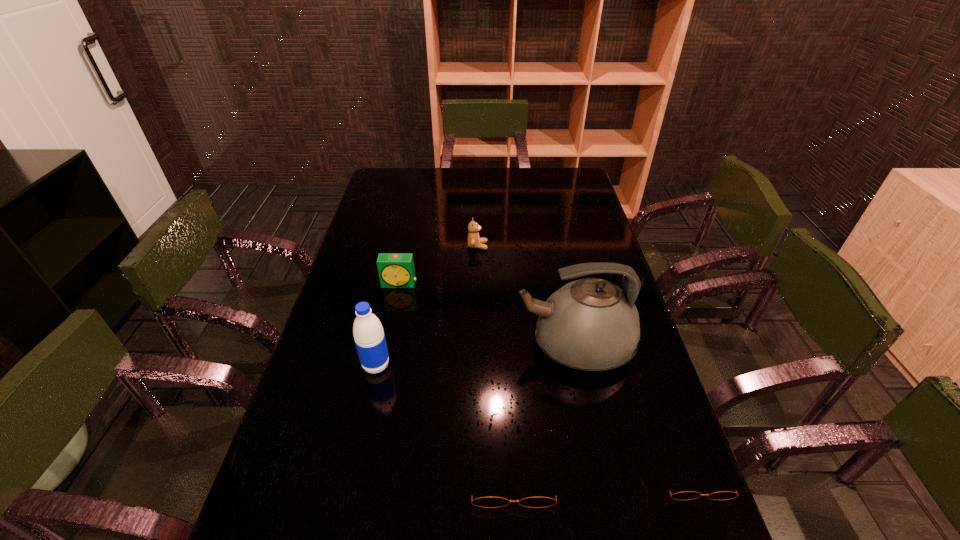
The image size is (960, 540). I want to click on free space for a new sunglasses on the left, so click(330, 479).